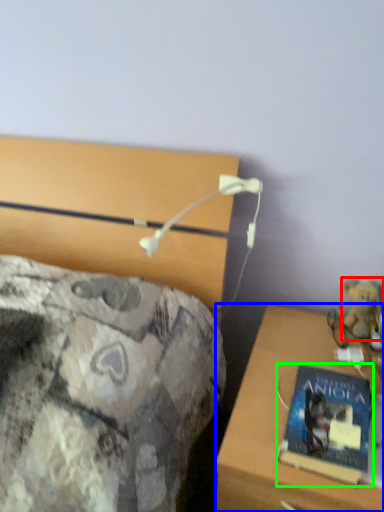
Question: Estimate the real-world distances between objects in this image. Which object is farther from teddy bear (highlighted by a red box), desk (highlighted by a blue box) or book (highlighted by a green box)?

Choices:
 (A) desk
 (B) book

Answer: (B)